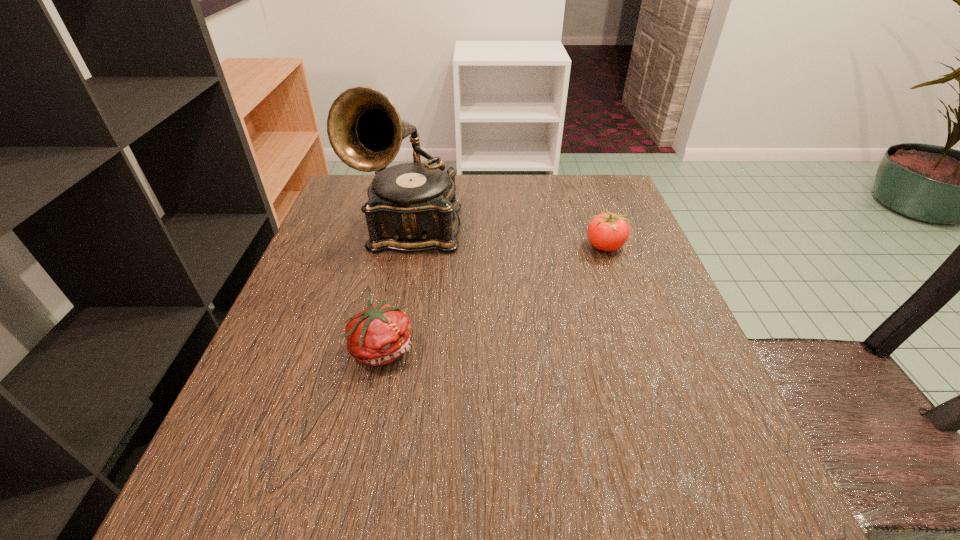
Locate which object is the second closest to the tallest object. Please provide its 2D coordinates. Your answer should be formatted as a tuple, i.e. [(x, y)], where the tuple contains the x and y coordinates of a point satisfying the conditions above.

[(608, 231)]

Find the location of `blank space that satisfies the following two spatial constraints: 1. on the horn of the phonograph record; 2. on the left side of the farther tomato`. blank space that satisfies the following two spatial constraints: 1. on the horn of the phonograph record; 2. on the left side of the farther tomato is located at coordinates (409, 246).

At what (x,y) coordinates should I click in order to perform the action: click on vacant space that satisfies the following two spatial constraints: 1. on the horn of the rightmost object; 2. on the left side of the tallest object. Please return your answer as a coordinate pair (x, y). The image size is (960, 540). Looking at the image, I should click on (409, 246).

I want to click on blank space that satisfies the following two spatial constraints: 1. on the horn of the tallest object; 2. on the left side of the farther tomato, so click(x=409, y=246).

What are the coordinates of `free location that satisfies the following two spatial constraints: 1. on the horn of the rightmost object; 2. on the left side of the phonograph record` in the screenshot? It's located at (409, 246).